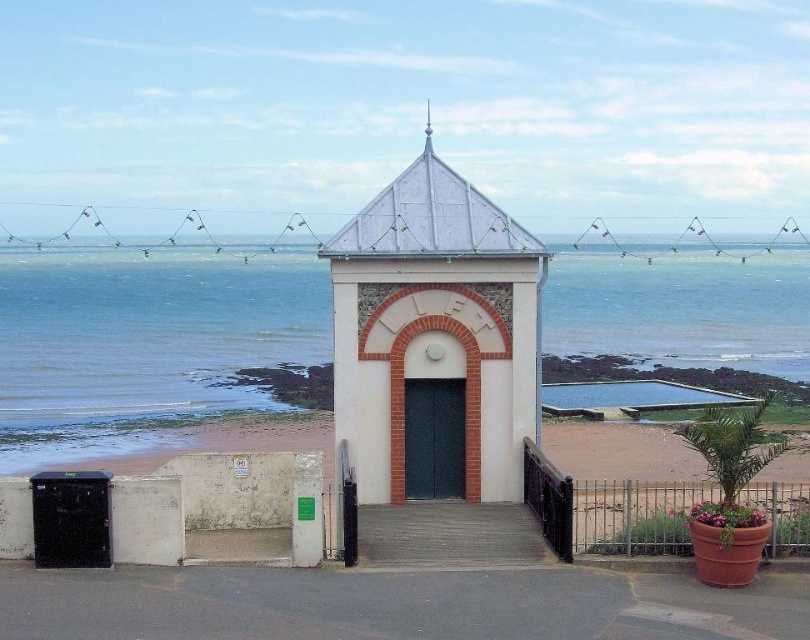
Describe the element at coordinates (435, 340) in the screenshot. The height and width of the screenshot is (640, 810). I see `white matte chapel at center` at that location.

How far apart are white matte chapel at center and smooth concrete stairs at center?

They are 2.12 meters apart.

Which is behind, point (519, 500) or point (458, 522)?

The point (519, 500) is more distant.

The width and height of the screenshot is (810, 640). What are the coordinates of `white matte chapel at center` in the screenshot? It's located at (435, 340).

Is blue water at center closer to camera compared to white matte chapel at center?

No, it is behind white matte chapel at center.

Is blue water at center above white matte chapel at center?

Incorrect, blue water at center is not positioned above white matte chapel at center.

Does point (75, 452) come farther from viewer compared to point (429, 132)?

Yes, it is.

Where is `blue water at center`? The width and height of the screenshot is (810, 640). blue water at center is located at coordinates (143, 346).

Is blue water at center in front of smooth concrete stairs at center?

No, blue water at center is further to the viewer.

How far apart are blue water at center and smooth concrete stairs at center?

44.25 meters

Which is in front, point (158, 417) or point (401, 564)?

Point (401, 564) is in front.

The width and height of the screenshot is (810, 640). Identify the location of blue water at center. (143, 346).